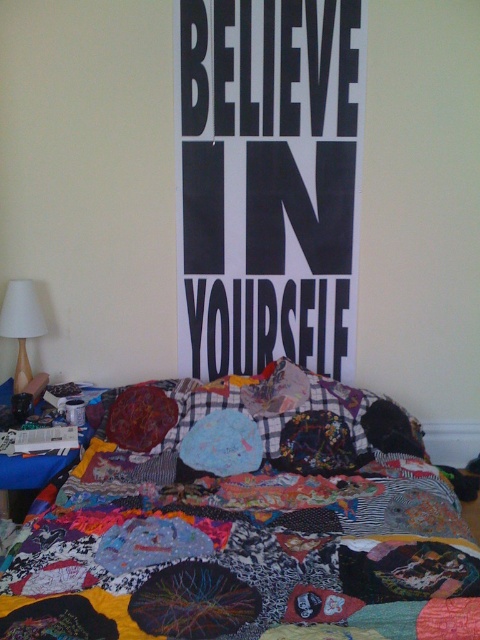
Where is the patchwork quilt at center located in the scene?

The patchwork quilt at center is located at point (250, 534).